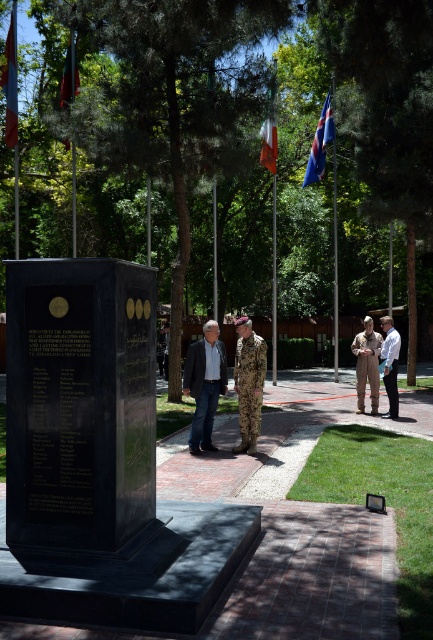
Question: Is camouflage fabric uniform at center positioned at the back of red fabric flag at upper left?

Choices:
 (A) yes
 (B) no

Answer: (B)

Question: Which point is farther to the camera?

Choices:
 (A) camouflage uniform at center
 (B) camouflage fabric uniform at center
 (C) red fabric flag at upper left

Answer: (C)

Question: Which object appears farthest from the camera in this image?

Choices:
 (A) orange fabric flag at upper center
 (B) blue fabric flag at upper center

Answer: (B)

Question: Which point appears farthest from the camera in this image?

Choices:
 (A) click(x=204, y=348)
 (B) click(x=396, y=337)

Answer: (B)

Question: Is red fabric flag at upper left positioned before blue fabric flag at upper center?

Choices:
 (A) no
 (B) yes

Answer: (B)

Question: Observing the image, what is the correct spatial positioning of camouflage fabric uniform at center in reference to blue fabric flag at upper center?

Choices:
 (A) right
 (B) left

Answer: (B)